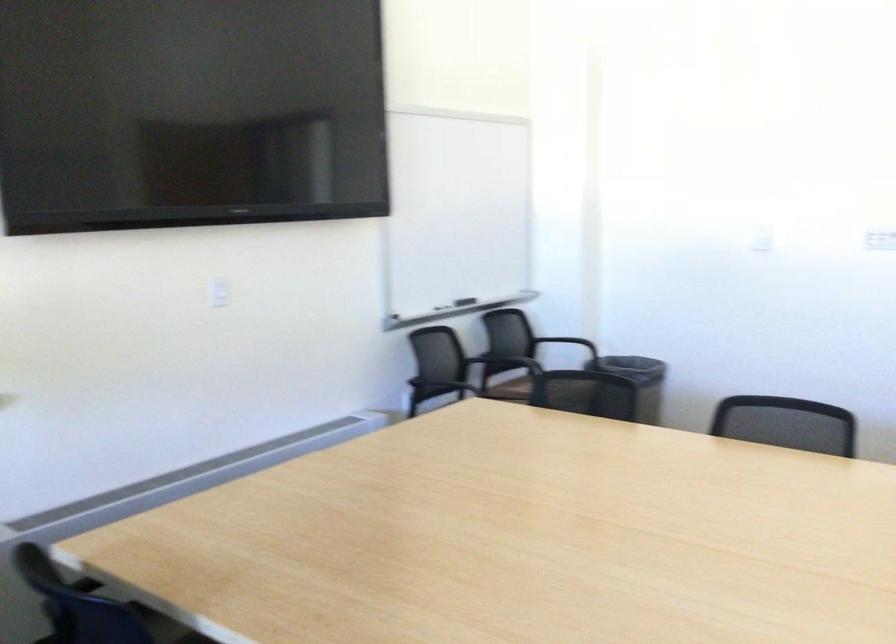
You are a GUI agent. You are given a task and a screenshot of the screen. Output one action in this format:
    pyautogui.click(x=<x>, y=<y>)
    Task: Click on the black trash can
    
    Given the screenshot: What is the action you would take?
    pyautogui.click(x=636, y=381)